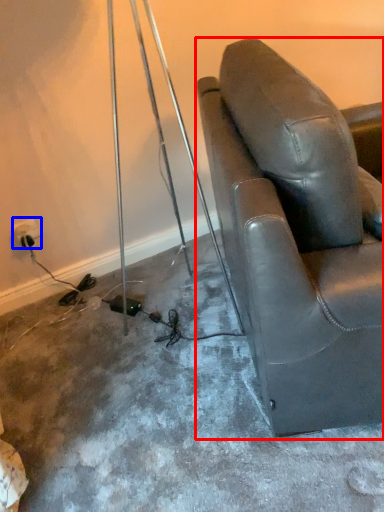
Question: Which object is further to the camera taking this photo, chair (highlighted by a red box) or electric outlet (highlighted by a blue box)?

Choices:
 (A) chair
 (B) electric outlet

Answer: (B)